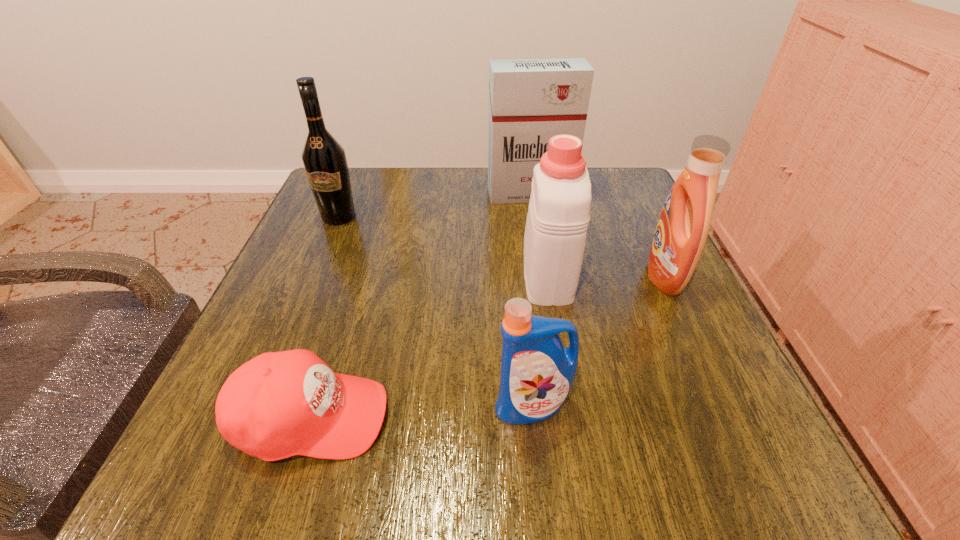
Locate an element on the screen. free space located 0.240m on the front-facing side of the rightmost object is located at coordinates (524, 276).

The image size is (960, 540). Identify the location of vacant region located 0.090m on the label of the second shortest object. (541, 491).

Locate an element on the screen. Image resolution: width=960 pixels, height=540 pixels. free space located 0.320m on the front panel of the baseball cap is located at coordinates (612, 417).

Identify the location of wine bottle that is positioned at the far edge. (324, 159).

Locate an element on the screen. The width and height of the screenshot is (960, 540). cigarette case present at the far edge is located at coordinates (530, 100).

This screenshot has width=960, height=540. I want to click on object that is at the near edge, so click(279, 404).

You are a GUI agent. You are given a task and a screenshot of the screen. Output one action in this format:
    pyautogui.click(x=<x>, y=<y>)
    Task: Click on the wine bottle at the left edge
    This screenshot has width=960, height=540.
    Given the screenshot: What is the action you would take?
    pyautogui.click(x=324, y=159)

This screenshot has width=960, height=540. What are the coordinates of `baseball cap at the left edge` in the screenshot? It's located at (279, 404).

At what (x,y) coordinates should I click in order to perform the action: click on object that is at the right edge. Please return your answer as a coordinate pair (x, y). The image size is (960, 540). Looking at the image, I should click on (680, 236).

This screenshot has width=960, height=540. What are the coordinates of `object present at the far left corner` in the screenshot? It's located at tap(324, 159).